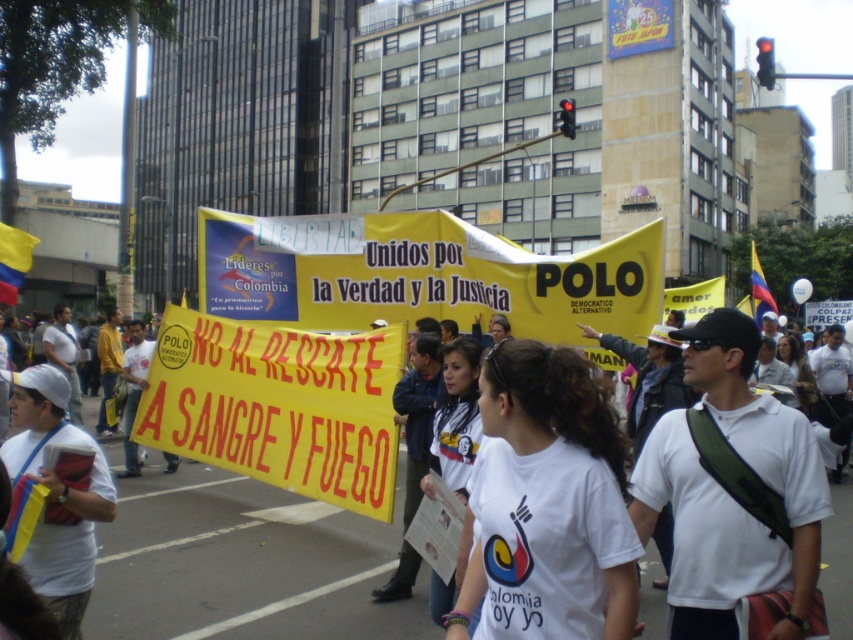
Question: Does yellow paper banner at center have a lesser width compared to white fabric shirt at left?

Choices:
 (A) yes
 (B) no

Answer: (B)

Question: Which of the following is the farthest from the observer?

Choices:
 (A) (32, 467)
 (B) (271, 435)

Answer: (B)

Question: Which of the following is the farthest from the observer?

Choices:
 (A) click(x=277, y=470)
 (B) click(x=91, y=492)

Answer: (A)

Question: Is yellow paper banner at center in front of white fabric shirt at left?

Choices:
 (A) no
 (B) yes

Answer: (A)

Question: Can you confirm if yellow paper banner at center is positioned above white fabric shirt at left?

Choices:
 (A) no
 (B) yes

Answer: (A)